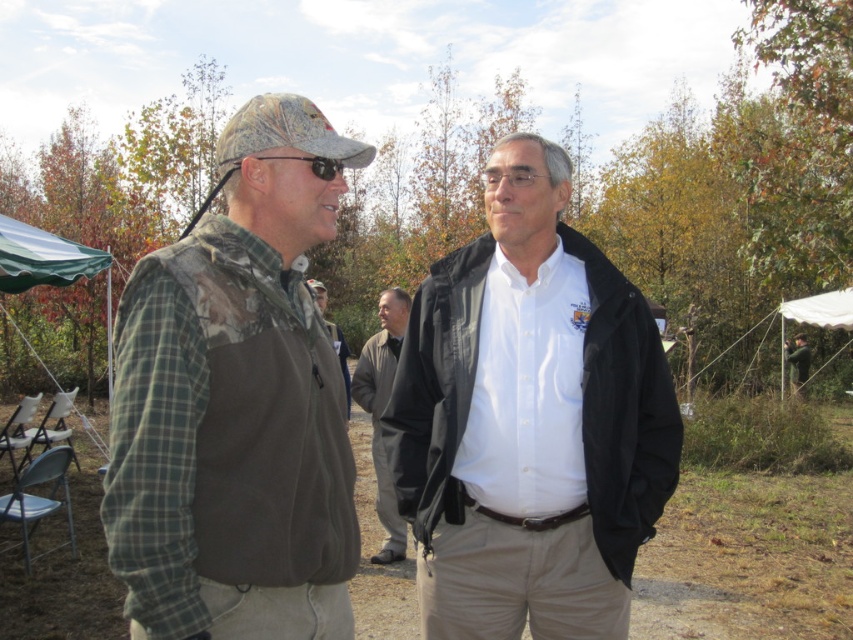
Question: Estimate the real-world distances between objects in this image. Which object is farther from the white matte shirt at center?

Choices:
 (A) camouflage fabric vest at center
 (B) white fabric canopy at right
 (C) green fabric jacket at center

Answer: (C)

Question: Can you confirm if white matte shirt at center is positioned to the left of green fabric jacket at center?

Choices:
 (A) no
 (B) yes

Answer: (B)

Question: Is dark gray jacket at center wider than green fabric canopy at upper left?

Choices:
 (A) no
 (B) yes

Answer: (A)

Question: Can you confirm if dark gray jacket at center is positioned to the left of green fabric canopy at upper left?

Choices:
 (A) yes
 (B) no

Answer: (B)

Question: Estimate the real-world distances between objects in this image. Which object is farther from the white fabric canopy at right?

Choices:
 (A) camouflage fabric vest at center
 (B) green fabric jacket at center
 (C) green fabric canopy at upper left

Answer: (A)

Question: Which object is positioned closest to the green fabric tent at left?

Choices:
 (A) white fabric canopy at right
 (B) dark gray jacket at center
 (C) camouflage jacket at center

Answer: (C)